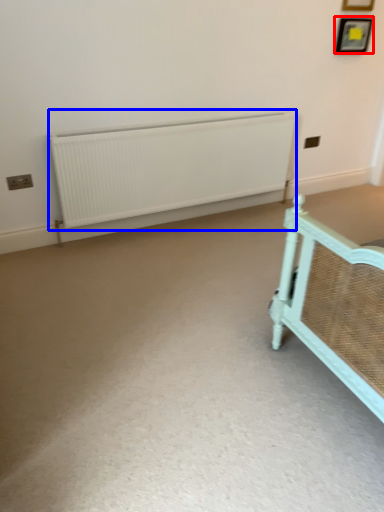
Question: Among these objects, which one is farthest to the camera, picture frame (highlighted by a red box) or radiator (highlighted by a blue box)?

Choices:
 (A) picture frame
 (B) radiator

Answer: (A)